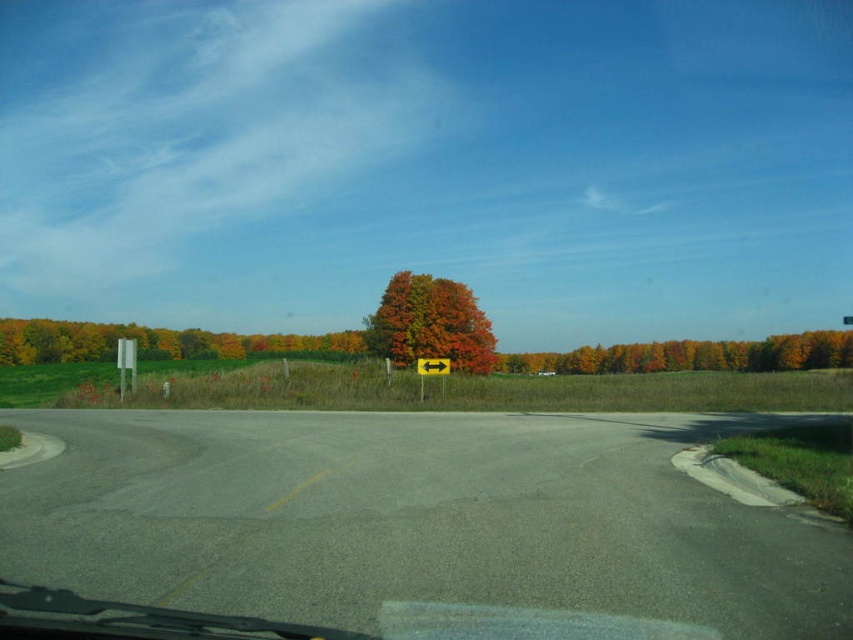
Measure the distance between point (766,369) and camera.

128.30 meters

Does orange matte tree at center appear on the right side of yellow plastic sign at center?

Correct, you'll find orange matte tree at center to the right of yellow plastic sign at center.

Where is `orange matte tree at center`? This screenshot has width=853, height=640. orange matte tree at center is located at coordinates [693, 355].

Is green matte tree at left above orange matte tree at center?

Correct, green matte tree at left is located above orange matte tree at center.

Does green matte tree at left have a lesser height compared to orange matte tree at center?

No.

Describe the element at coordinates (152, 340) in the screenshot. The width and height of the screenshot is (853, 640). I see `green matte tree at left` at that location.

Image resolution: width=853 pixels, height=640 pixels. What are the coordinates of `green matte tree at left` in the screenshot? It's located at (152, 340).

Can you confirm if green matte tree at left is positioned below yellow plastic sign at center?

Incorrect, green matte tree at left is not positioned below yellow plastic sign at center.

Between point (39, 356) and point (434, 365), which one is positioned behind?

Point (39, 356)

You are a GUI agent. You are given a task and a screenshot of the screen. Output one action in this format:
    pyautogui.click(x=<x>, y=<y>)
    Task: Click on the green matte tree at left
    
    Given the screenshot: What is the action you would take?
    pyautogui.click(x=152, y=340)

Locate an element on the screen. green matte tree at left is located at coordinates (152, 340).